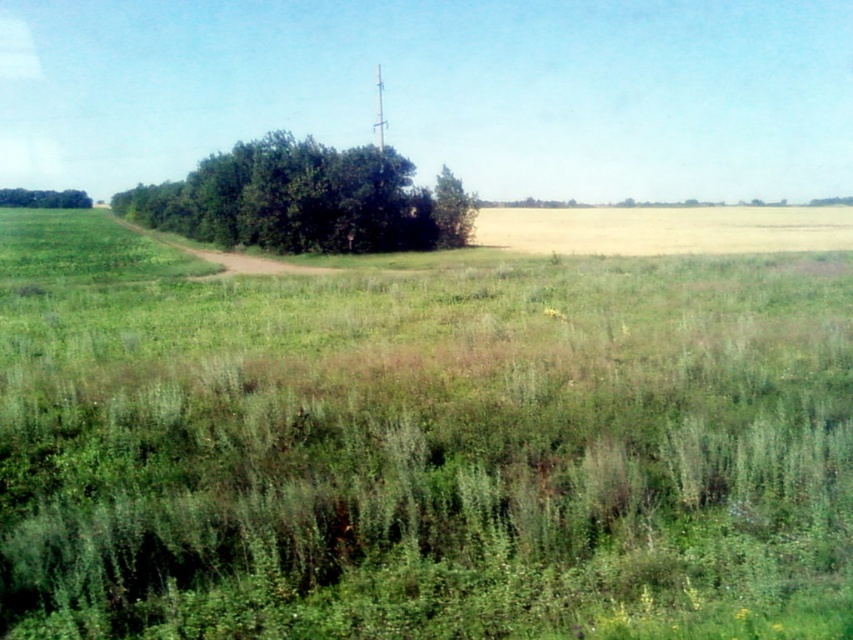
You are a gardener planning to plant a new tree in this rural landscape. You notice the green leafy tree at center and the green leafy tree at left. Which tree has a larger canopy width?

The green leafy tree at center might be wider than green leafy tree at left according to the description.

You are a hiker trying to find the tallest tree in the area. You see the green leafy tree at center and the green leafy tree at left. Which one should you approach to find the taller tree?

The green leafy tree at center is much taller than the green leafy tree at left, so you should approach the green leafy tree at center to find the taller tree.